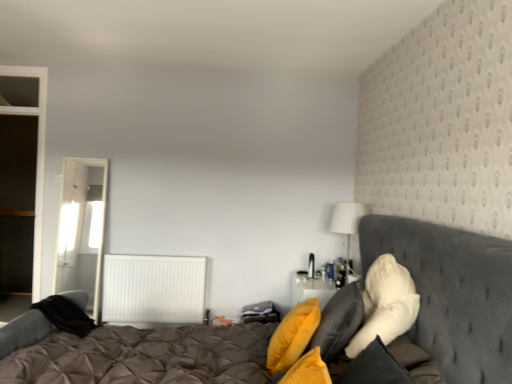
Question: Can you confirm if white fabric lampshade at upper right is wider than white fluffy pillow at right, the 3th pillow positioned from the left?

Choices:
 (A) no
 (B) yes

Answer: (B)

Question: Are white fabric lampshade at upper right and white fluffy pillow at right, marked as the first pillow in a right-to-left arrangement, located far from each other?

Choices:
 (A) no
 (B) yes

Answer: (B)

Question: Is white fluffy pillow at right, the 3th pillow positioned from the left, inside white fabric lampshade at upper right?

Choices:
 (A) no
 (B) yes

Answer: (A)

Question: Is the position of white fabric lampshade at upper right more distant than that of white fluffy pillow at right, marked as the first pillow in a right-to-left arrangement?

Choices:
 (A) no
 (B) yes

Answer: (B)

Question: Can you confirm if white fabric lampshade at upper right is shorter than white fluffy pillow at right, marked as the first pillow in a right-to-left arrangement?

Choices:
 (A) no
 (B) yes

Answer: (B)

Question: Considering the positions of tufted fabric bed at center and soft yellow pillow at right, arranged as the 2th pillow when viewed from the right, in the image, is tufted fabric bed at center bigger or smaller than soft yellow pillow at right, arranged as the 2th pillow when viewed from the right,?

Choices:
 (A) small
 (B) big

Answer: (B)

Question: From their relative heights in the image, would you say tufted fabric bed at center is taller or shorter than soft yellow pillow at right, the second pillow viewed from the left?

Choices:
 (A) short
 (B) tall

Answer: (B)

Question: Looking at their shapes, would you say tufted fabric bed at center is wider or thinner than soft yellow pillow at right, the second pillow viewed from the left?

Choices:
 (A) thin
 (B) wide

Answer: (B)

Question: Is point (471, 241) positioned closer to the camera than point (336, 339)?

Choices:
 (A) closer
 (B) farther

Answer: (A)

Question: Considering the relative positions of tufted fabric bed at center and white textured radiator at center in the image provided, is tufted fabric bed at center to the left or to the right of white textured radiator at center?

Choices:
 (A) right
 (B) left

Answer: (A)

Question: From a real-world perspective, is tufted fabric bed at center positioned above or below white textured radiator at center?

Choices:
 (A) below
 (B) above

Answer: (B)

Question: In the image, is tufted fabric bed at center positioned in front of or behind white textured radiator at center?

Choices:
 (A) front
 (B) behind

Answer: (A)

Question: Is tufted fabric bed at center taller or shorter than white textured radiator at center?

Choices:
 (A) short
 (B) tall

Answer: (B)

Question: Considering their positions, is white textured radiator at center located in front of or behind tufted fabric bed at center?

Choices:
 (A) front
 (B) behind

Answer: (B)

Question: Is point (143, 266) closer or farther from the camera than point (138, 337)?

Choices:
 (A) closer
 (B) farther

Answer: (B)